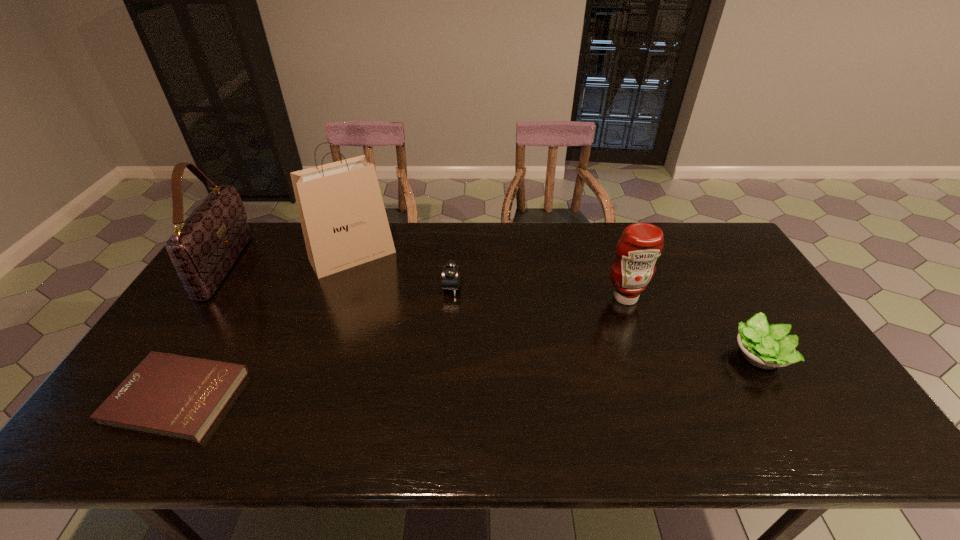
This screenshot has width=960, height=540. In order to click on blank area in the image that satisfies the following two spatial constraints: 1. on the front of the shortest object with the clasp; 2. on the right side of the handbag in this screenshot , I will do `click(137, 397)`.

Locate an element on the screen. vacant space that satisfies the following two spatial constraints: 1. on the front side of the fifth object from left to right; 2. on the left side of the fourth object from left to right is located at coordinates (451, 298).

Where is `vacant space that satisfies the following two spatial constraints: 1. on the back side of the hardback book; 2. on the right side of the third tallest object`? The width and height of the screenshot is (960, 540). vacant space that satisfies the following two spatial constraints: 1. on the back side of the hardback book; 2. on the right side of the third tallest object is located at coordinates (237, 298).

The height and width of the screenshot is (540, 960). Find the location of `vacant space that satisfies the following two spatial constraints: 1. on the front side of the third object from left to right; 2. on the left side of the condiment`. vacant space that satisfies the following two spatial constraints: 1. on the front side of the third object from left to right; 2. on the left side of the condiment is located at coordinates (338, 298).

The width and height of the screenshot is (960, 540). I want to click on vacant space that satisfies the following two spatial constraints: 1. on the front of the handbag with the clasp; 2. on the right side of the rightmost object, so click(165, 355).

Find the location of a particular element. The height and width of the screenshot is (540, 960). vacant area that satisfies the following two spatial constraints: 1. on the front side of the shopping bag; 2. on the front of the handbag with the clasp is located at coordinates (349, 266).

Find the location of a particular element. free location that satisfies the following two spatial constraints: 1. on the front of the shortest object with the clasp; 2. on the left side of the handbag is located at coordinates (137, 397).